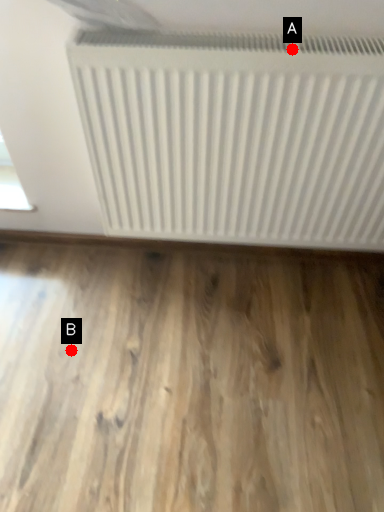
Question: Two points are circled on the image, labeled by A and B beside each circle. Among these points, which one is farthest from the camera?

Choices:
 (A) A is further
 (B) B is further

Answer: (B)